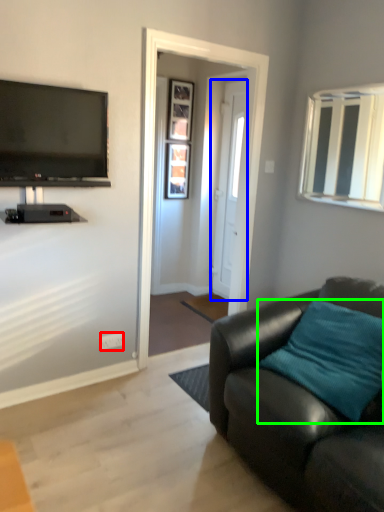
Question: Considering the real-world distances, which object is farthest from power outlet (highlighted by a red box)? door (highlighted by a blue box) or pillow (highlighted by a green box)?

Choices:
 (A) door
 (B) pillow

Answer: (A)